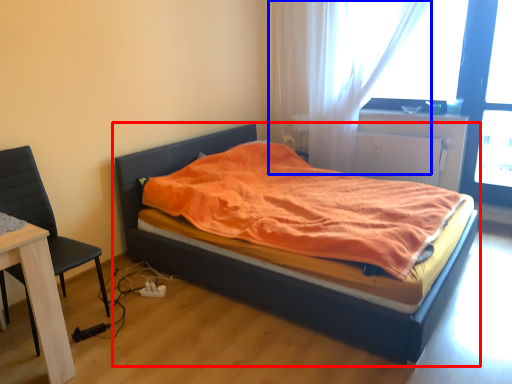
Question: Among these objects, which one is farthest to the camera, bed (highlighted by a red box) or curtain (highlighted by a blue box)?

Choices:
 (A) bed
 (B) curtain

Answer: (B)